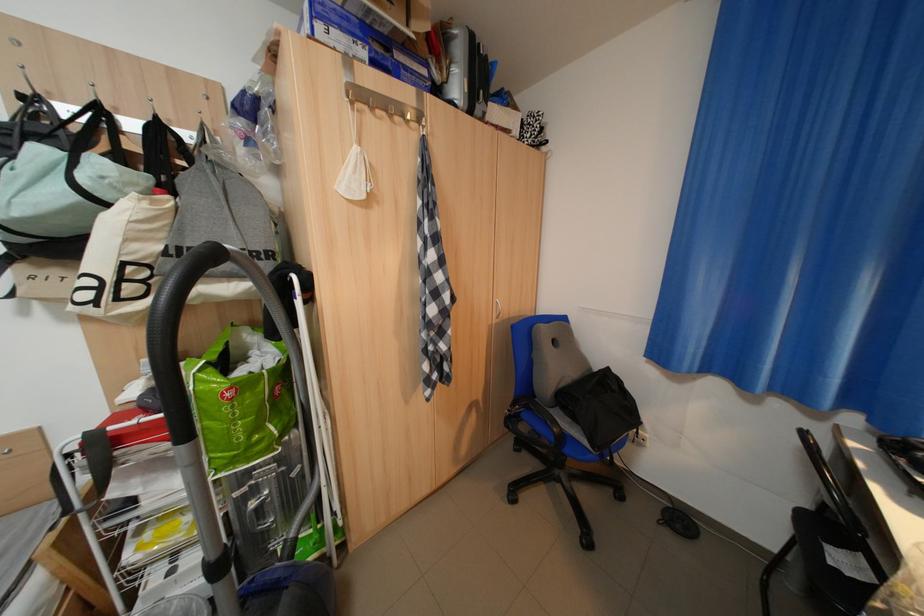
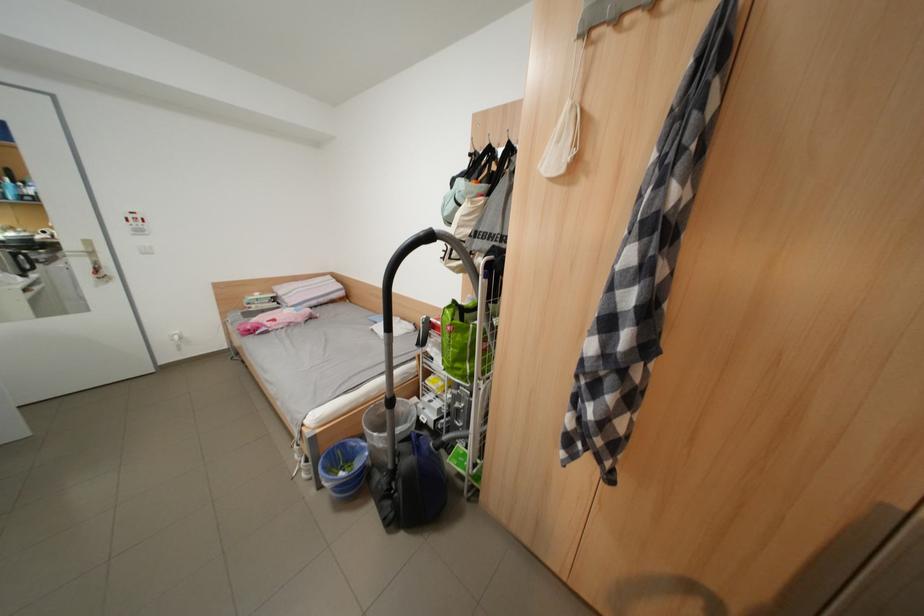
In the second image, find the point that corresponds to point (261, 439) in the first image.

(466, 363)